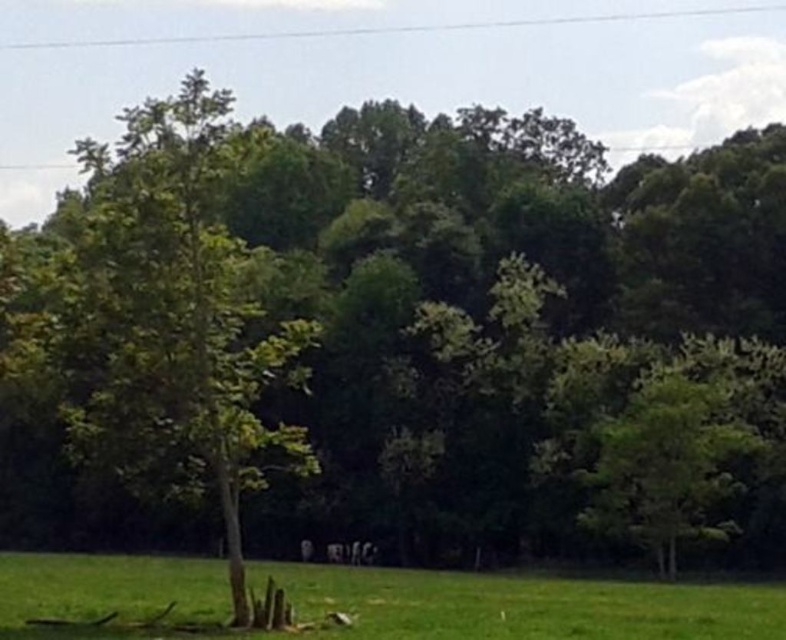
Is green leafy tree at left smaller than green leafy tree at right?

No, green leafy tree at left is not smaller than green leafy tree at right.

At what (x,y) coordinates should I click in order to perform the action: click on green leafy tree at left. Please return your answer as a coordinate pair (x, y). This screenshot has width=786, height=640. Looking at the image, I should click on (175, 317).

In order to click on green leafy tree at left in this screenshot , I will do `click(175, 317)`.

Can you confirm if green leafy tree at left is thinner than green grass at lower center?

No.

Who is more forward, [189,348] or [362,636]?

Point [362,636] is in front.

What are the coordinates of `green leafy tree at left` in the screenshot? It's located at (175, 317).

Find the location of a particular element. The image size is (786, 640). green leafy tree at left is located at coordinates (175, 317).

Is green grass at lower center to the right of green leafy tree at right from the viewer's perspective?

Incorrect, green grass at lower center is not on the right side of green leafy tree at right.

Image resolution: width=786 pixels, height=640 pixels. What do you see at coordinates (520, 604) in the screenshot?
I see `green grass at lower center` at bounding box center [520, 604].

Measure the distance between point (x=46, y=566) and camera.

Point (x=46, y=566) and camera are 58.66 meters apart.

Locate an element on the screen. green grass at lower center is located at coordinates (520, 604).